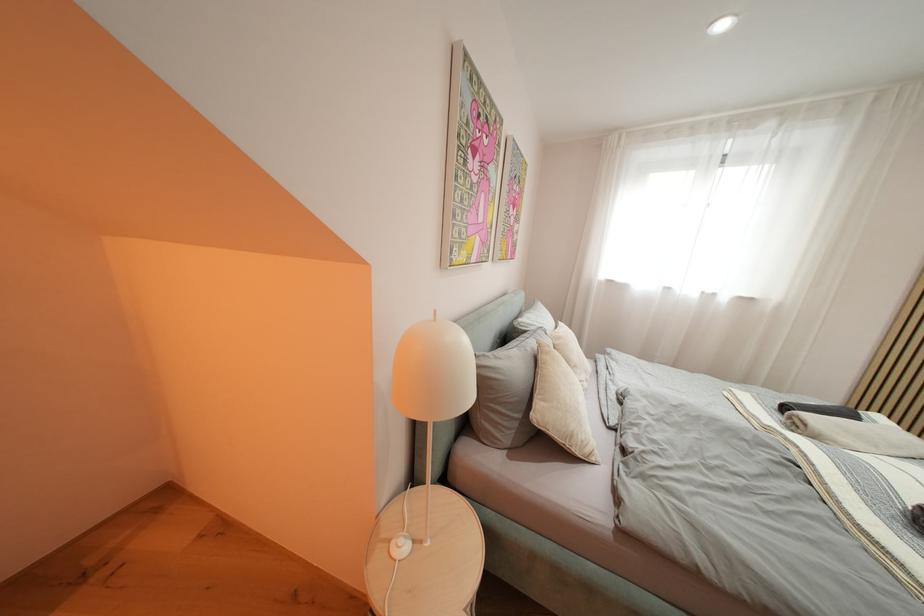
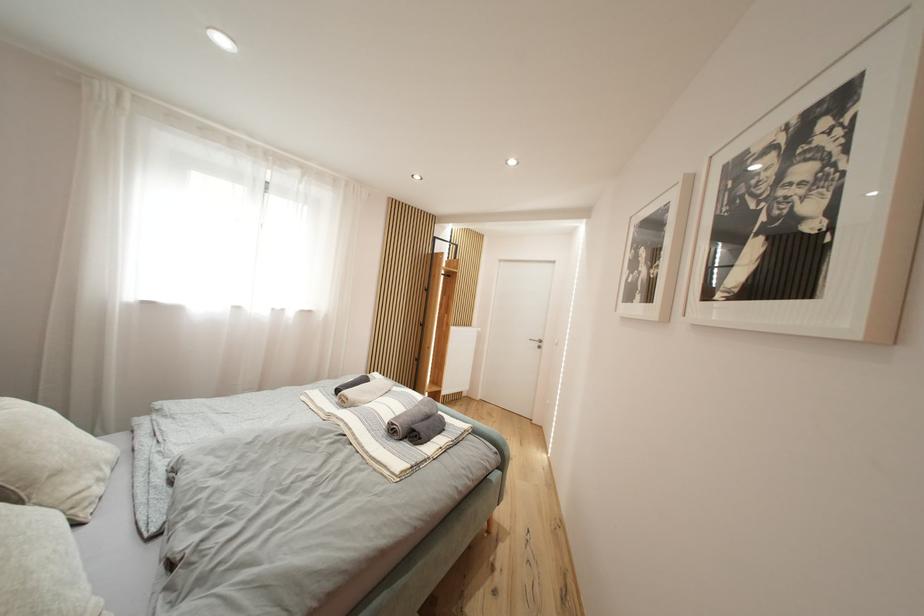
Question: The images are taken continuously from a first-person perspective. In which direction is your viewpoint rotating?

Choices:
 (A) Left
 (B) Right
 (C) Up
 (D) Down

Answer: (B)